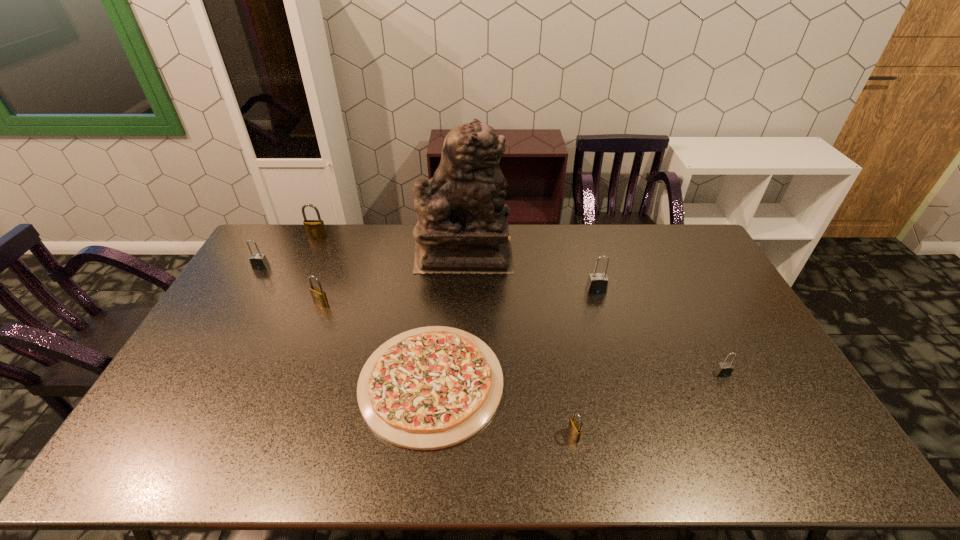
This screenshot has width=960, height=540. Find the location of `blank space located on the left of the nearest brass padlock`. blank space located on the left of the nearest brass padlock is located at coordinates (425, 435).

This screenshot has height=540, width=960. Find the location of `free spot located on the left of the shortest object`. free spot located on the left of the shortest object is located at coordinates (283, 382).

Image resolution: width=960 pixels, height=540 pixels. I want to click on sculpture present at the far edge, so click(x=462, y=227).

Find the location of a particular element. The width and height of the screenshot is (960, 540). padlock located in the far edge section of the desktop is located at coordinates (315, 229).

Locate an element on the screen. The height and width of the screenshot is (540, 960). padlock that is at the near edge is located at coordinates (574, 428).

In order to click on pizza located at the near edge in this screenshot , I will do [x=429, y=388].

This screenshot has width=960, height=540. I want to click on object that is positioned at the left edge, so click(x=259, y=261).

Identify the location of object that is at the right edge. The image size is (960, 540). (724, 369).

This screenshot has height=540, width=960. In order to click on free region at the far edge in this screenshot , I will do `click(542, 258)`.

I want to click on vacant position at the near edge of the desktop, so click(x=761, y=463).